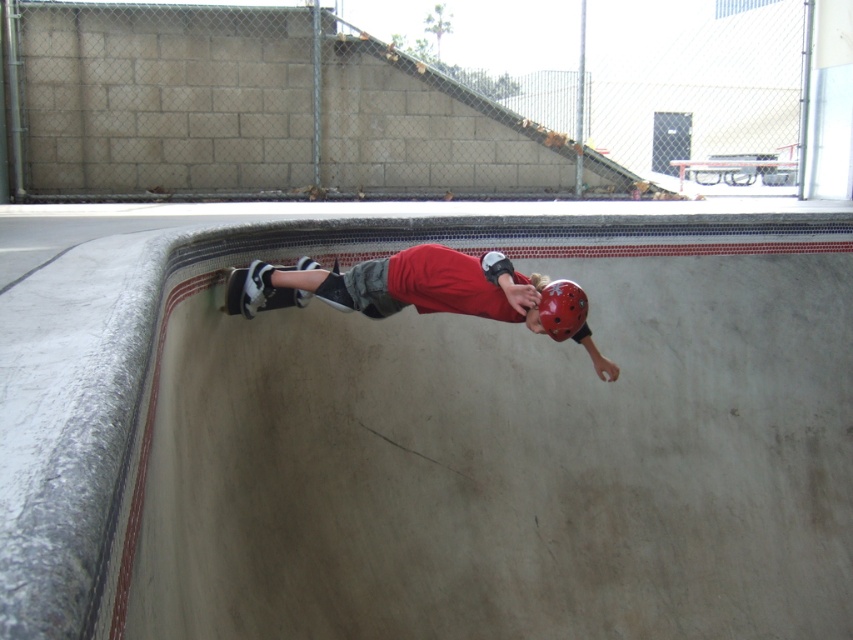
Question: Does smooth concrete skate park at center appear on the left side of red matte helmet at center?

Choices:
 (A) no
 (B) yes

Answer: (A)

Question: Which point is closer to the camera?

Choices:
 (A) smooth concrete skate park at center
 (B) matte red helmet at center
 (C) red matte helmet at center

Answer: (A)

Question: Which point is farther to the camera?

Choices:
 (A) red matte helmet at center
 (B) white rubber skateboard at lower left
 (C) matte red helmet at center

Answer: (B)

Question: Which of the following is the farthest from the observer?

Choices:
 (A) white rubber skateboard at lower left
 (B) smooth concrete skate park at center
 (C) matte red helmet at center

Answer: (A)

Question: Does smooth concrete skate park at center have a lesser width compared to matte red helmet at center?

Choices:
 (A) no
 (B) yes

Answer: (A)

Question: Is red matte helmet at center wider than matte red helmet at center?

Choices:
 (A) no
 (B) yes

Answer: (B)